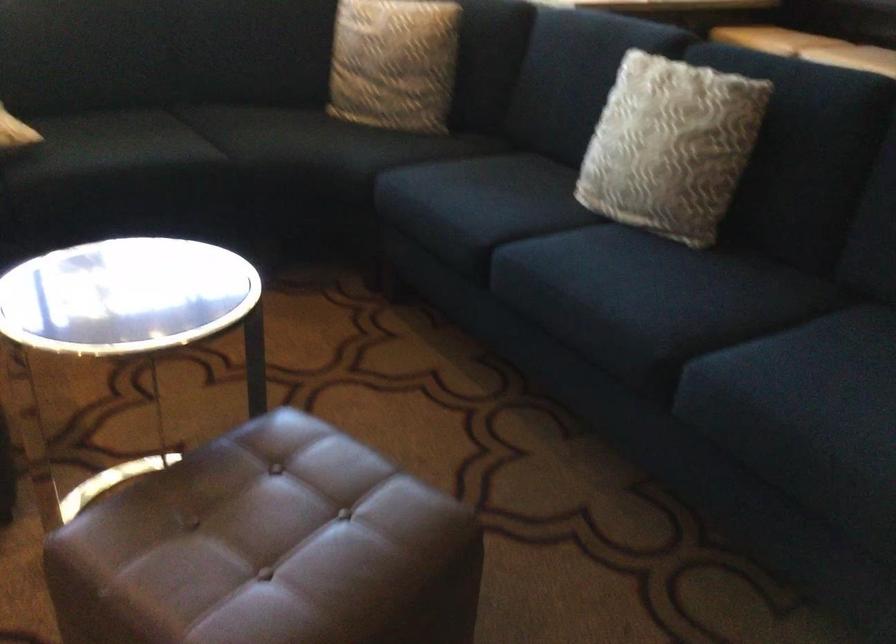
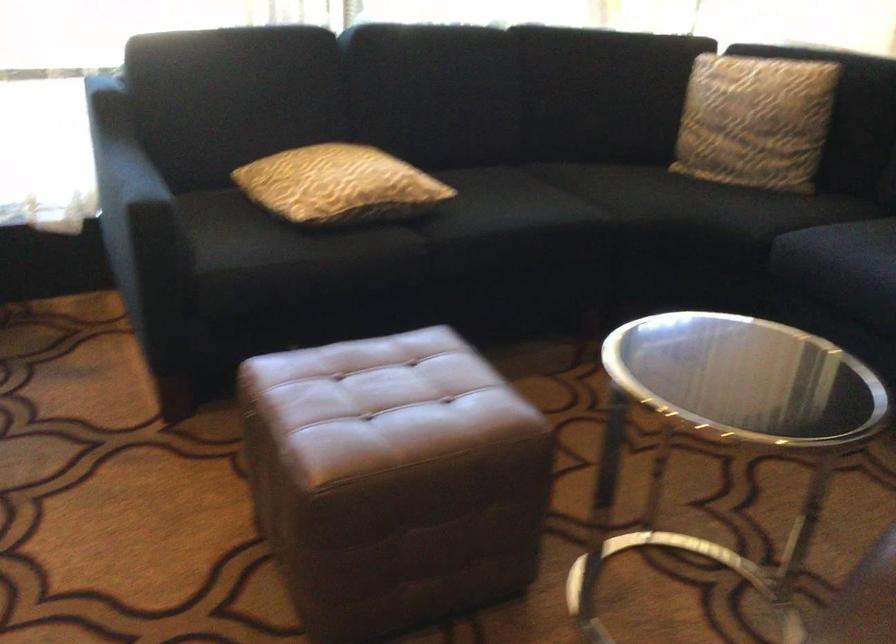
Where in the second image is the point corresponding to the point at 383,67 from the first image?

(754, 120)